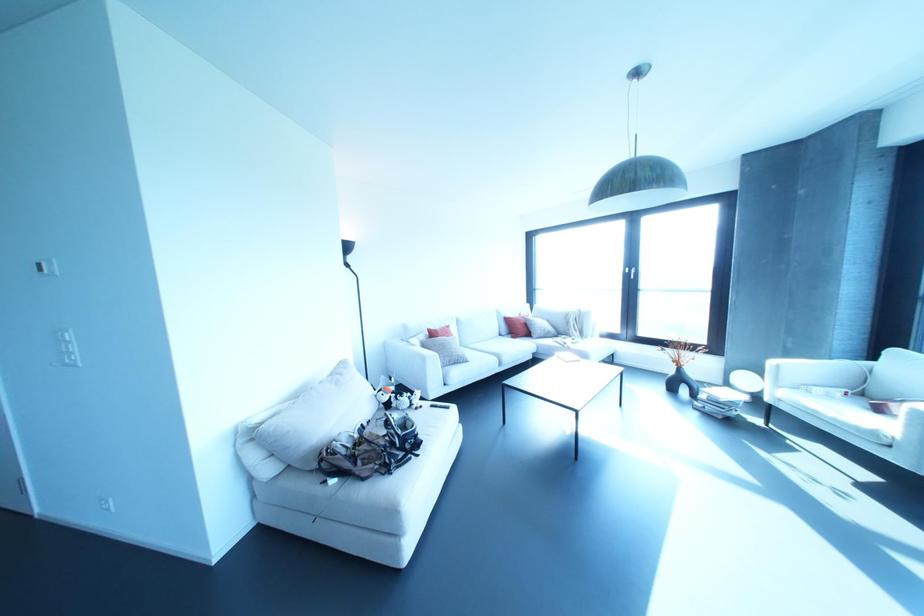
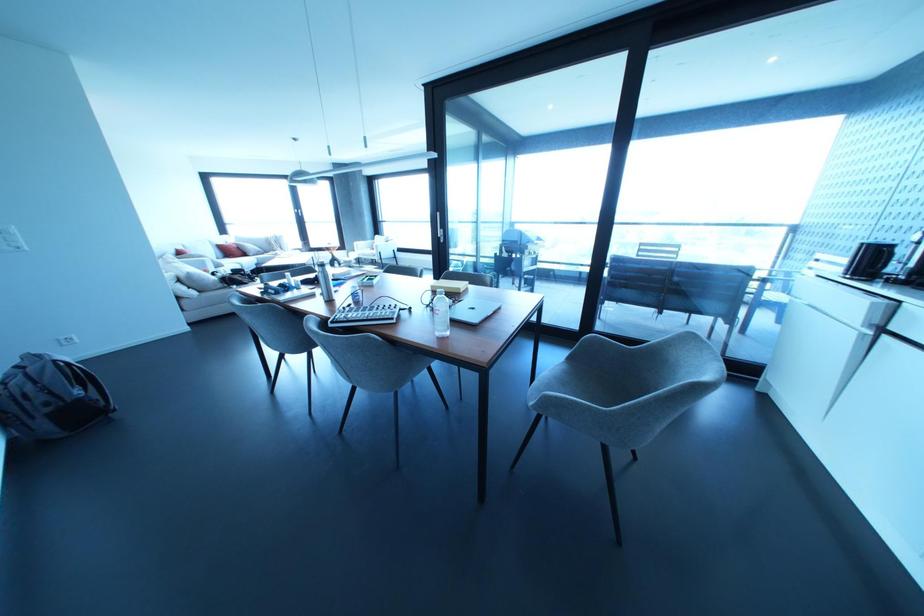
In the second image, find the point that corresponds to point (540, 323) in the first image.

(249, 246)